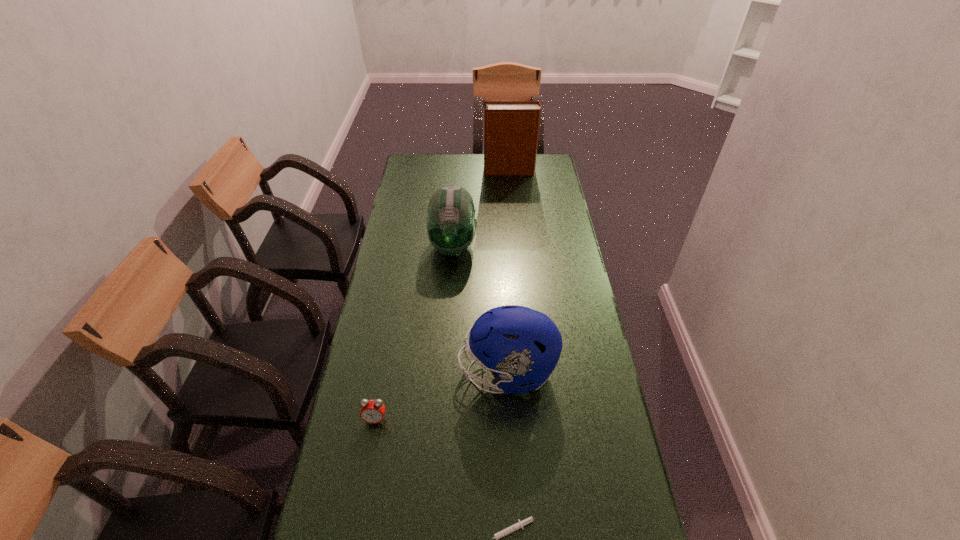
At what (x,y) coordinates should I click in order to perform the action: click on the farthest object. Please return your answer as a coordinate pair (x, y). Looking at the image, I should click on (511, 128).

Where is `hardback book`? Image resolution: width=960 pixels, height=540 pixels. hardback book is located at coordinates (511, 128).

At what (x,y) coordinates should I click in order to perform the action: click on the nearer football helmet. Please return your answer as a coordinate pair (x, y). The width and height of the screenshot is (960, 540). Looking at the image, I should click on (520, 345).

You are a GUI agent. You are given a task and a screenshot of the screen. Output one action in this format:
    pyautogui.click(x=<x>, y=<y>)
    Task: Click on the second farthest object
    
    Given the screenshot: What is the action you would take?
    pyautogui.click(x=451, y=225)

The width and height of the screenshot is (960, 540). I want to click on the fourth farthest object, so click(x=372, y=411).

Where is `the second shortest object`? The height and width of the screenshot is (540, 960). the second shortest object is located at coordinates (372, 411).

Find the location of a particular element. This screenshot has width=960, height=540. free spot located on the open cover of the tallest object is located at coordinates (442, 171).

Locate an element on the screen. This screenshot has width=960, height=540. vacant region located 0.180m on the open cover of the tallest object is located at coordinates (447, 171).

Image resolution: width=960 pixels, height=540 pixels. What are the coordinates of `vacant space located on the open cover of the tallest object` in the screenshot? It's located at (468, 171).

Locate an element on the screen. This screenshot has width=960, height=540. blank area located 0.100m on the face guard of the third farthest object is located at coordinates (x=425, y=372).